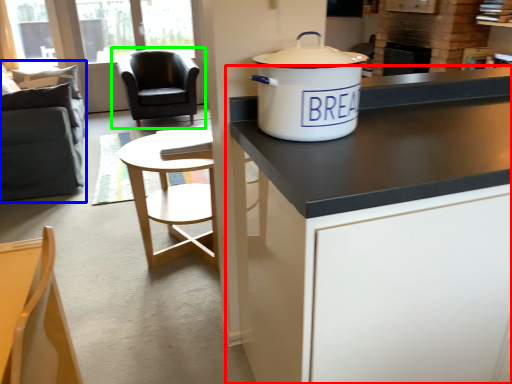
Question: Which is nearer to the cabinetry (highlighted by a red box)? swivel chair (highlighted by a blue box) or chair (highlighted by a green box).

Choices:
 (A) swivel chair
 (B) chair

Answer: (A)